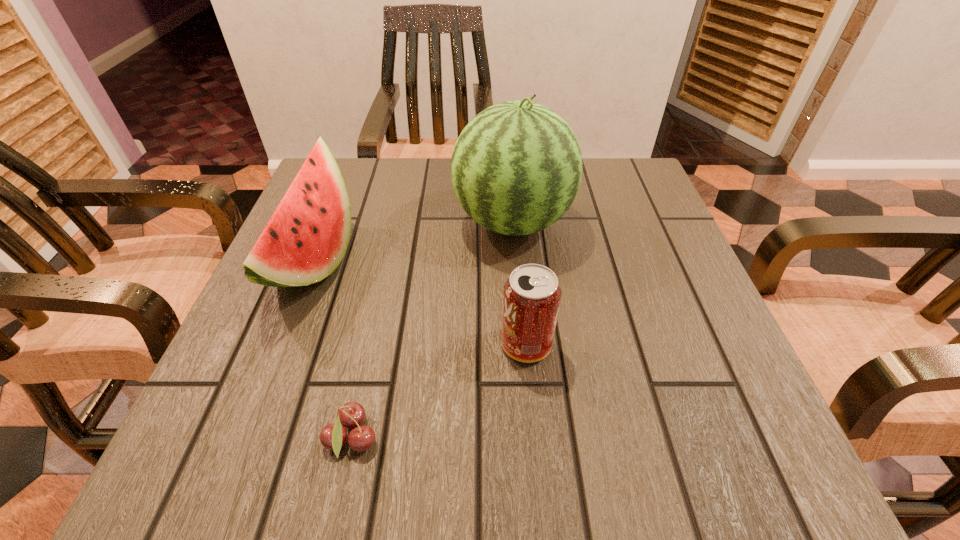
This screenshot has height=540, width=960. In order to click on free space that is in between the left watermelon and the cherry in this screenshot , I will do `click(333, 350)`.

Locate an element on the screen. This screenshot has height=540, width=960. vacant point located between the second tallest object and the cherry is located at coordinates [333, 350].

Where is `empty space that is in between the tallest object and the left watermelon`? This screenshot has height=540, width=960. empty space that is in between the tallest object and the left watermelon is located at coordinates [414, 241].

The width and height of the screenshot is (960, 540). Identify the location of vacant point located between the second tallest object and the second shortest object. (420, 303).

In order to click on vacant point located between the tallest object and the leftmost object in this screenshot , I will do `click(414, 241)`.

At what (x,y) coordinates should I click in order to perform the action: click on vacant region between the second tallest object and the taller watermelon. Please return your answer as a coordinate pair (x, y). The height and width of the screenshot is (540, 960). Looking at the image, I should click on (414, 241).

The image size is (960, 540). Identify the location of unoccupied area between the tallest object and the nearest object. (432, 331).

Locate an element on the screen. The width and height of the screenshot is (960, 540). vacant point located between the leftmost object and the nearest object is located at coordinates (333, 350).

Locate an element on the screen. This screenshot has width=960, height=540. vacant space that is in between the taller watermelon and the shorter watermelon is located at coordinates (414, 241).

At what (x,y) coordinates should I click in order to perform the action: click on object that is the third closest to the nearest object. Please return your answer as a coordinate pair (x, y). The width and height of the screenshot is (960, 540). Looking at the image, I should click on (516, 168).